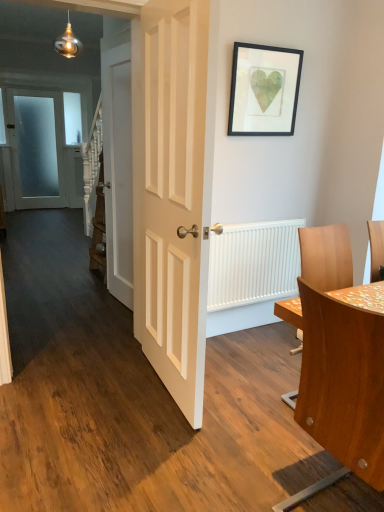
What are the coordinates of `vacant space in front of white wooden door at center, acting as the second door starting from the back` in the screenshot? It's located at (101, 318).